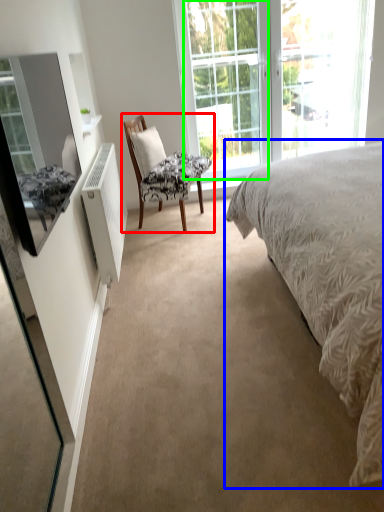
Question: Which is nearer to the chair (highlighted by a red box)? bed (highlighted by a blue box) or glass door (highlighted by a green box).

Choices:
 (A) bed
 (B) glass door

Answer: (B)